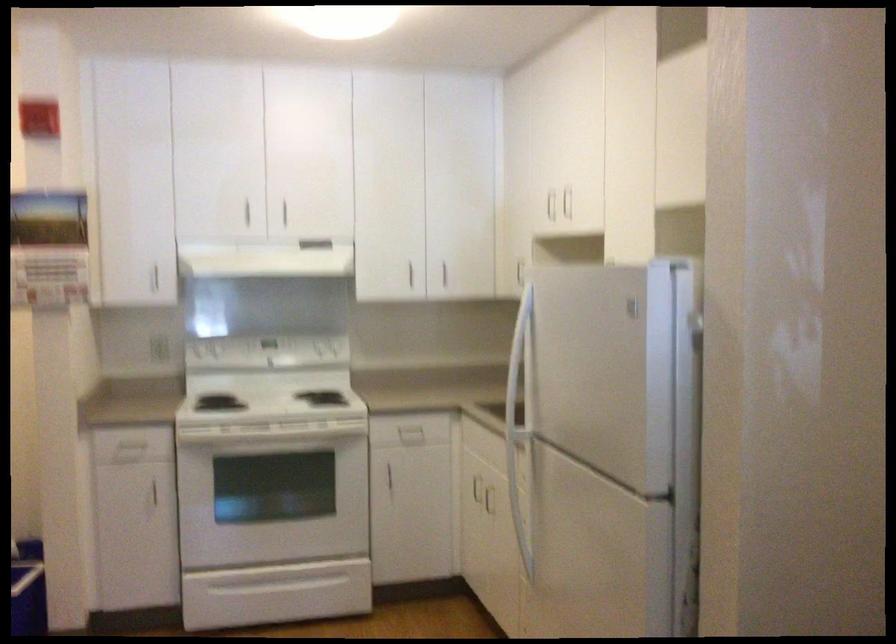
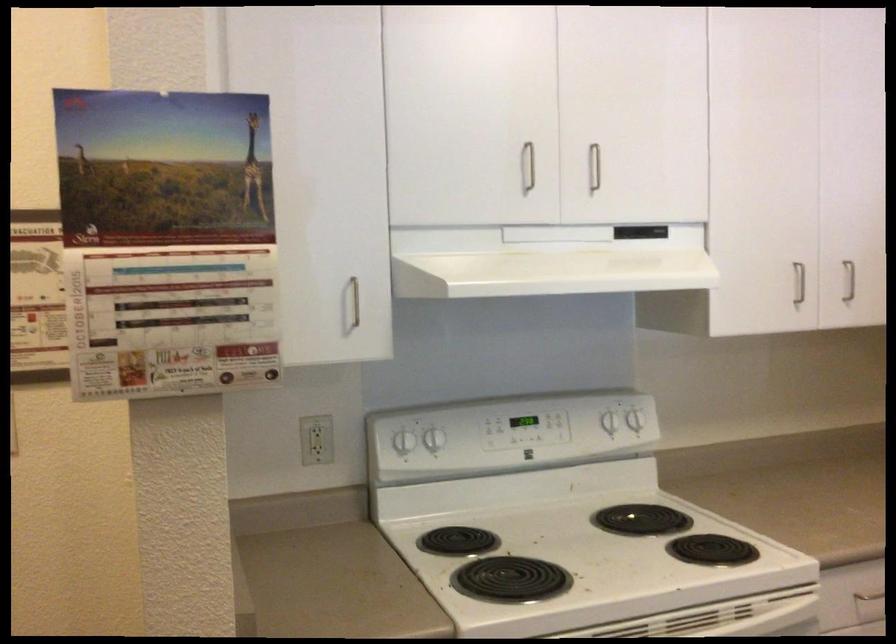
Where in the second image is the point corresponding to (332,344) from the first image?

(634, 420)